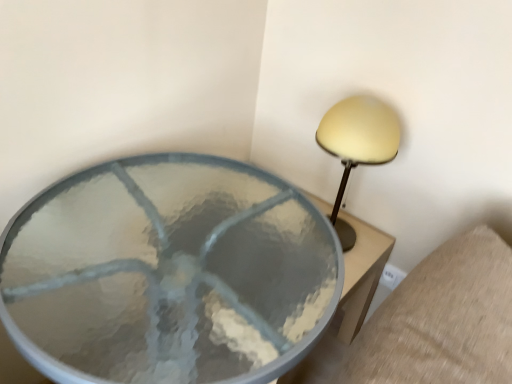
At what (x,y) coordinates should I click in order to perform the action: click on vacant region above clear glass table at center (from a real-world perspective). Please return your answer as a coordinate pair (x, y). Looking at the image, I should click on (182, 245).